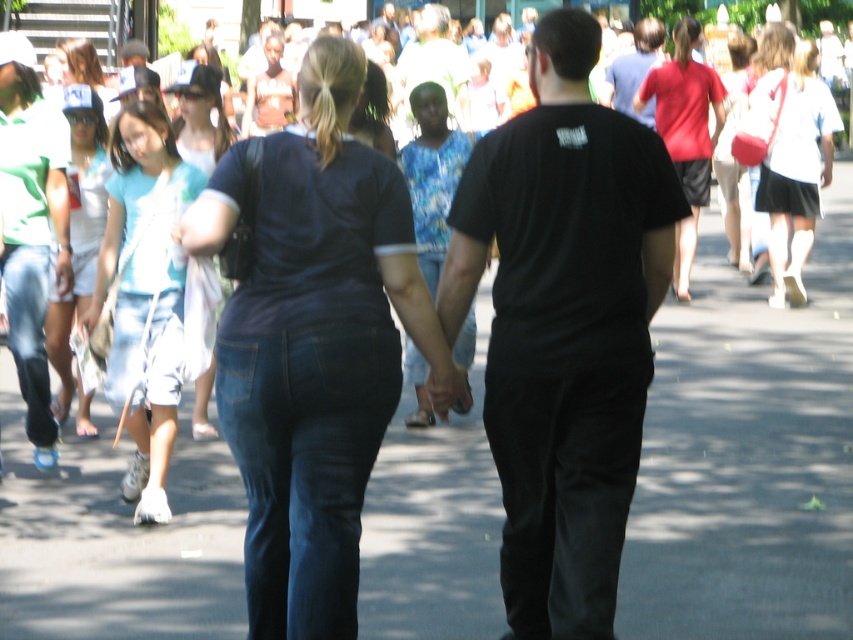
You are standing at the center of the paved area and want to find the black matte shirt at center. According to the coordinates provided, in which direction should you look to locate it?

The black matte shirt at center is located at coordinates point (564, 324), so you should look slightly to the right and down from the very center of your view.

You are standing in the middle of the paved area shaded by trees and see the point marked at coordinates (564, 324). What object is located at that point?

The point at coordinates (564, 324) corresponds to the black matte shirt at center.